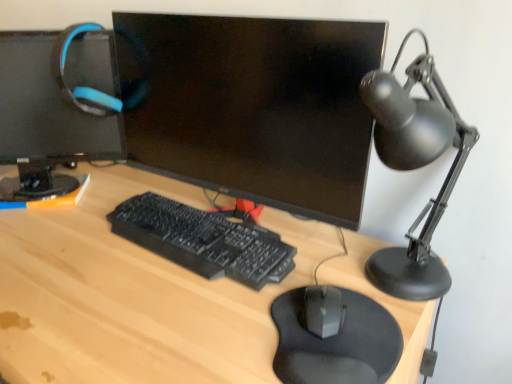
Locate an element on the screen. The image size is (512, 384). empty space that is in between black plastic keyboard at center and black matte mousepad at lower center is located at coordinates (209, 293).